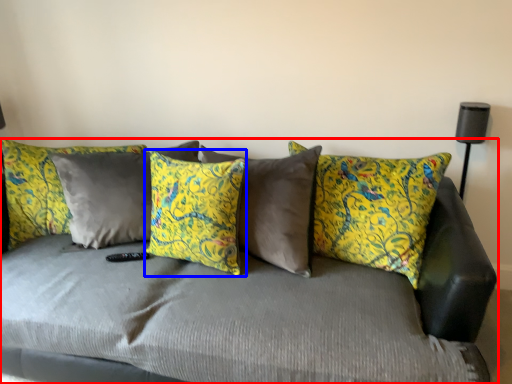
Question: Which point is further to the camera, studio couch (highlighted by a red box) or pillow (highlighted by a blue box)?

Choices:
 (A) studio couch
 (B) pillow

Answer: (B)